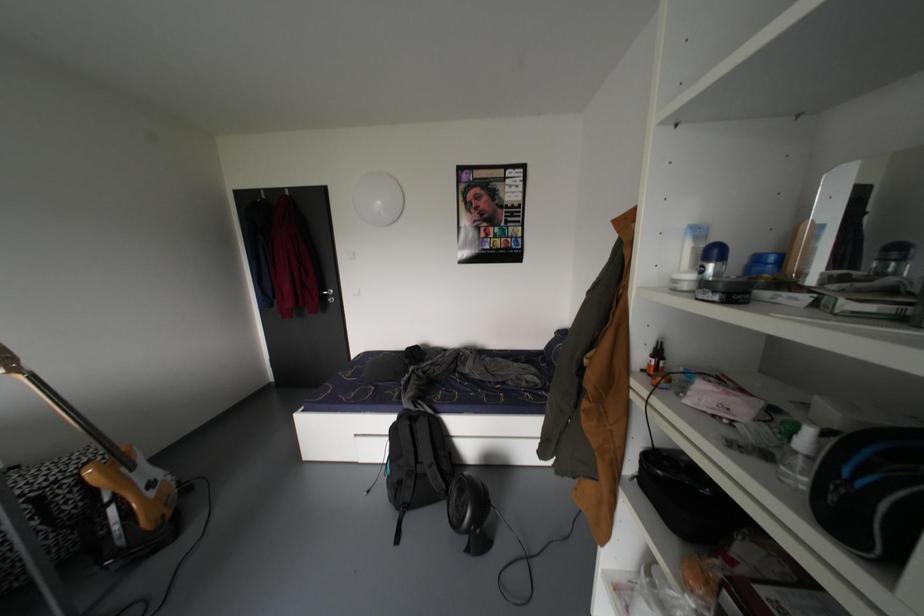
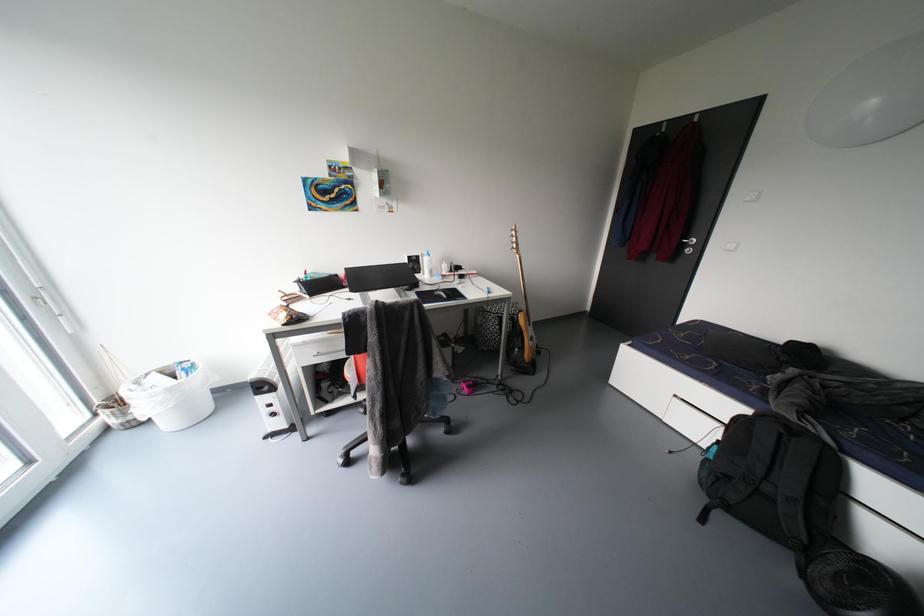
In the scene shown: The first image is from the beginning of the video and the second image is from the end. How did the camera likely rotate when shooting the video?

The camera rotated toward left-down.